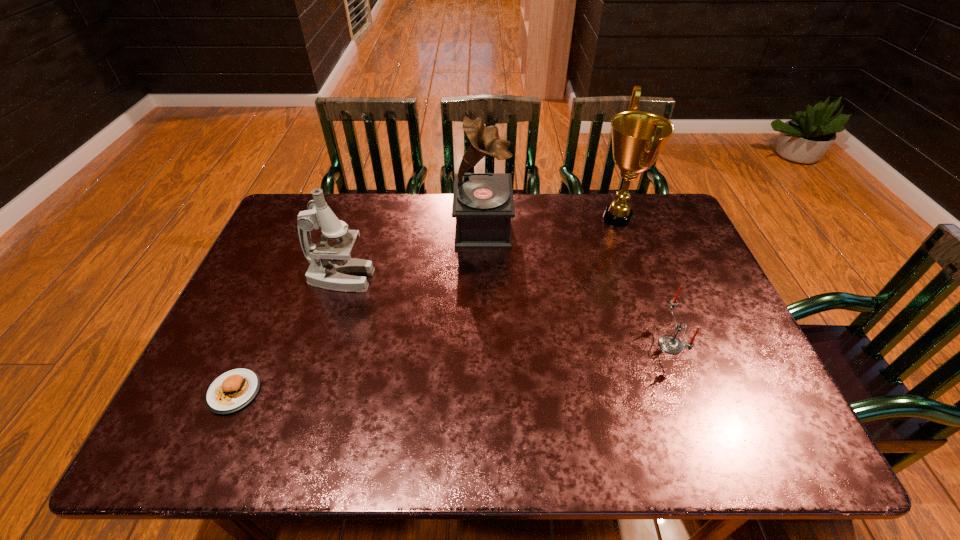
The image size is (960, 540). I want to click on blank area located 0.210m on the front view with handles of the award, so click(528, 218).

Locate an element on the screen. The width and height of the screenshot is (960, 540). vacant space situated at the horn opening of the third object from left to right is located at coordinates (406, 227).

Locate an element on the screen. This screenshot has height=540, width=960. vacant position located 0.310m at the horn opening of the third object from left to right is located at coordinates (360, 227).

Identify the location of vacant space located at the horn opening of the third object from left to right. (381, 227).

The image size is (960, 540). I want to click on vacant region located 0.270m on the back of the third shortest object, so click(363, 211).

Locate an element on the screen. The image size is (960, 540). free spot located on the front-facing side of the fourth farthest object is located at coordinates (619, 345).

I want to click on vacant space located on the front-facing side of the fourth farthest object, so click(x=579, y=345).

You are a GUI agent. You are given a task and a screenshot of the screen. Output one action in this format:
    pyautogui.click(x=<x>, y=<y>)
    Task: Click on the vacant area situated on the front-facing side of the fourth farthest object
    The image size is (960, 540).
    Given the screenshot: What is the action you would take?
    pyautogui.click(x=627, y=345)

The image size is (960, 540). I want to click on free space located on the back of the nearest object, so click(x=292, y=261).

You are a GUI agent. You are given a task and a screenshot of the screen. Output one action in this format:
    pyautogui.click(x=<x>, y=<y>)
    Task: Click on the award located in the far edge section of the desktop
    This screenshot has height=540, width=960.
    Given the screenshot: What is the action you would take?
    pyautogui.click(x=638, y=137)